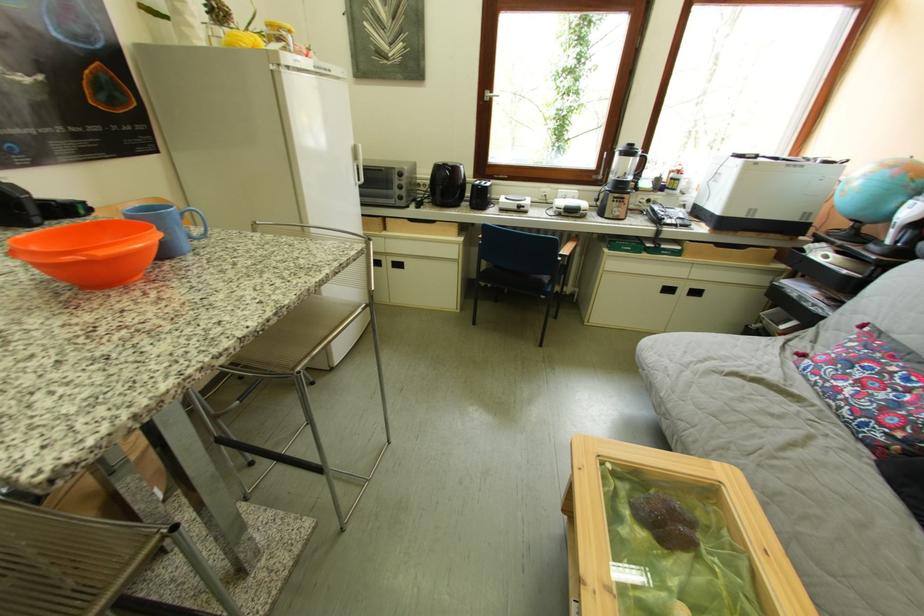
Locate an element on the screen. black electric kettle is located at coordinates (446, 184).